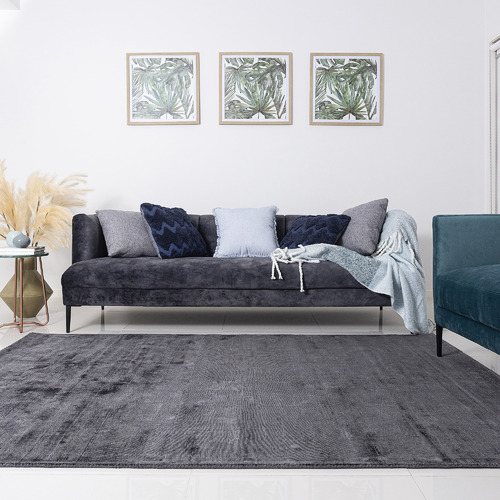
The width and height of the screenshot is (500, 500). Identify the location of couch. (461, 307).